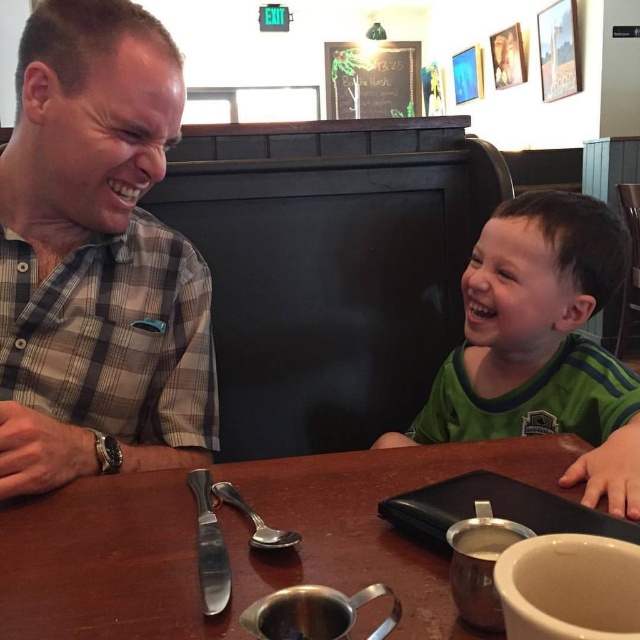
Question: Can you confirm if plaid shirt at left is positioned above metallic silver creamer at center?

Choices:
 (A) yes
 (B) no

Answer: (A)

Question: Which of these objects is positioned farthest from the brown wooden table at center?

Choices:
 (A) metallic silver creamer at center
 (B) plaid shirt at left

Answer: (A)

Question: Which point appears closest to the camera in this image?

Choices:
 (A) (173, 566)
 (B) (17, 131)
 (C) (472, 529)

Answer: (C)

Question: Among these objects, which one is nearest to the camera?

Choices:
 (A) brown wooden table at center
 (B) plaid shirt at left
 (C) metallic silver creamer at center
 (D) green jersey at right

Answer: (C)

Question: Does plaid shirt at left appear on the left side of green jersey at right?

Choices:
 (A) yes
 (B) no

Answer: (A)

Question: Is brown wooden table at center positioned at the back of metallic silver creamer at center?

Choices:
 (A) yes
 (B) no

Answer: (A)